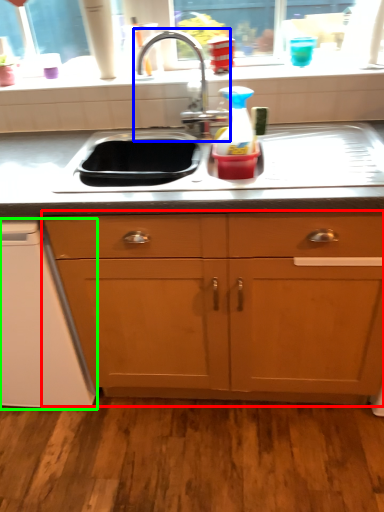
Question: Which is nearer to the cabinetry (highlighted by a red box)? tap (highlighted by a blue box) or dish washer (highlighted by a green box).

Choices:
 (A) tap
 (B) dish washer

Answer: (B)